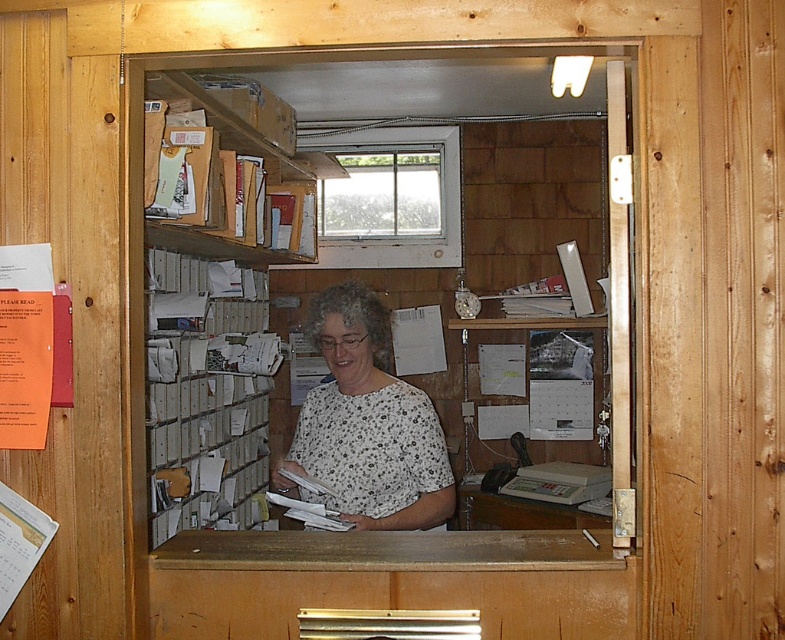
Question: Can you confirm if clear glass window at upper center is positioned to the left of wooden shelves at upper left?

Choices:
 (A) yes
 (B) no

Answer: (B)

Question: Is wooden shelves at left positioned in front of white wooden window at upper center?

Choices:
 (A) no
 (B) yes

Answer: (B)

Question: Which of these objects is positioned farthest from the white wooden window at upper center?

Choices:
 (A) wooden shelves at upper left
 (B) wooden shelves at left
 (C) clear glass window at upper center

Answer: (B)

Question: Which is farther from the white wooden window at upper center?

Choices:
 (A) wooden shelves at upper left
 (B) clear glass window at upper center
 (C) white paper at left
 (D) wooden shelves at left

Answer: (C)

Question: Which point appears closest to the camera in this image?

Choices:
 (A) (414, 227)
 (B) (145, 80)

Answer: (B)

Question: Considering the relative positions of wooden shelves at left and white wooden window at upper center in the image provided, where is wooden shelves at left located with respect to white wooden window at upper center?

Choices:
 (A) left
 (B) right

Answer: (A)